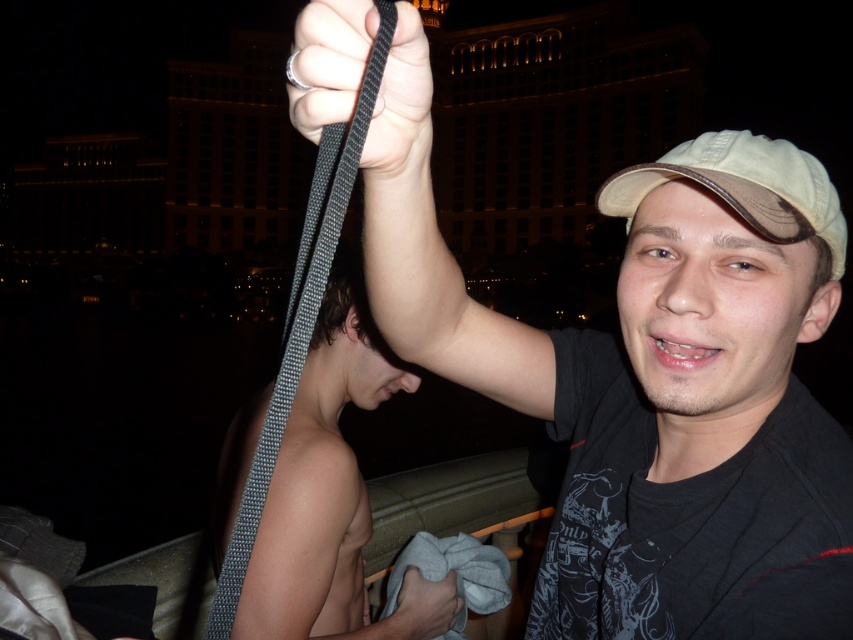
You are a photographer trying to capture a clear photo of the black woven strap at upper center and the white fabric cap at upper center in the nighttime scene. Since the strap is larger than the cap, which object should you focus on first to ensure both are in frame?

The black woven strap at upper center is larger in size than the white fabric cap at upper center, so you should focus on the black woven strap at upper center first to ensure both are in frame.

You are an observer looking at the nighttime scene. You notice the black textured strap at upper center and the white fabric cap at upper center. Which object is positioned higher in the image?

The black textured strap at upper center is located above the white fabric cap at upper center, so it is positioned higher in the image.